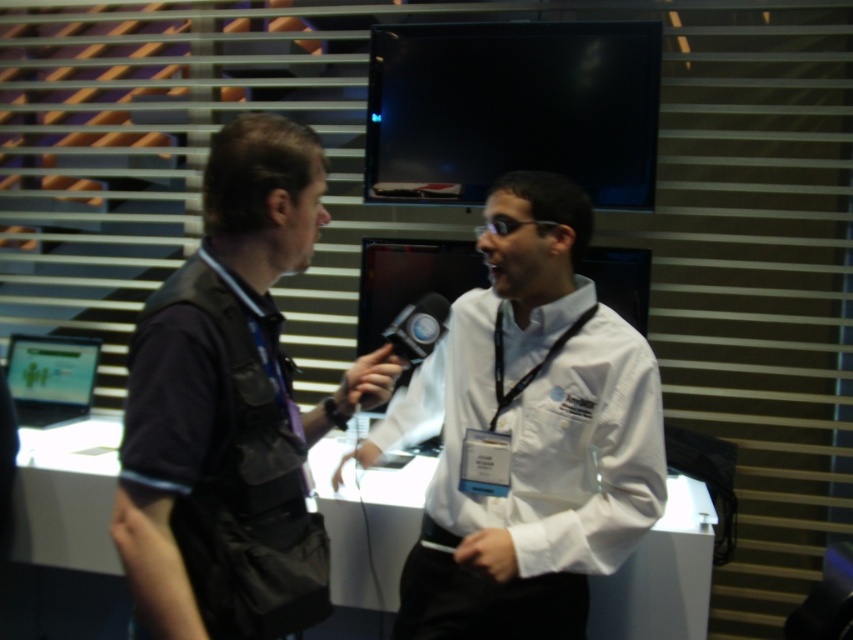
You are a GUI agent. You are given a task and a screenshot of the screen. Output one action in this format:
    pyautogui.click(x=<x>, y=<y>)
    Task: Click on the white glossy shirt at center
    
    Given the screenshot: What is the action you would take?
    pyautogui.click(x=532, y=435)